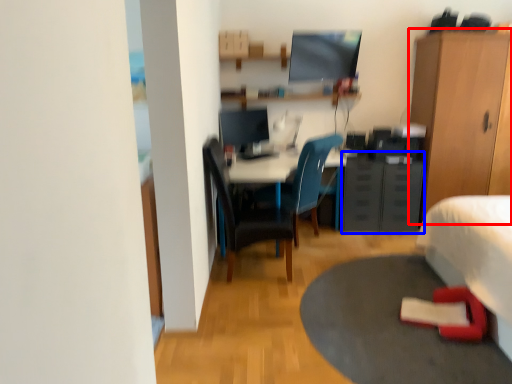
Question: Which object appears closest to the camera in this image, cabinetry (highlighted by a red box) or file cabinet (highlighted by a blue box)?

Choices:
 (A) cabinetry
 (B) file cabinet

Answer: (A)